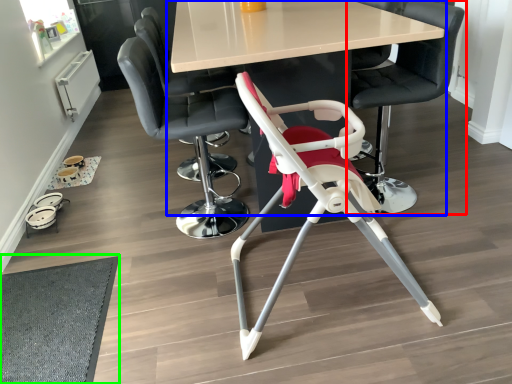
Question: Considering the real-world distances, which object is closest to chair (highlighted by a red box)? table (highlighted by a blue box) or mat (highlighted by a green box).

Choices:
 (A) table
 (B) mat

Answer: (A)